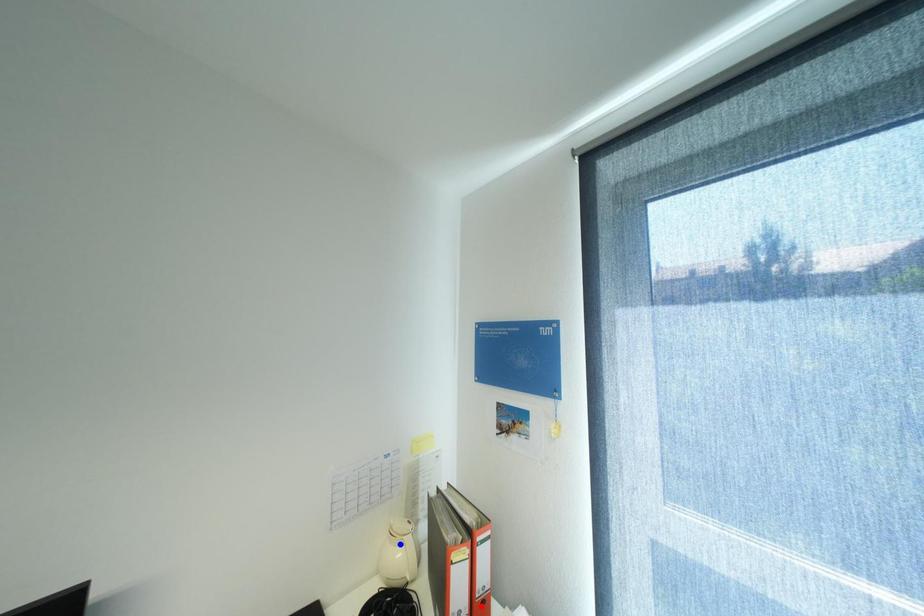
Question: In the image, two points are highlighted. Which point is nearer to the camera? Reply with the corresponding letter.

Choices:
 (A) blue point
 (B) red point

Answer: (B)